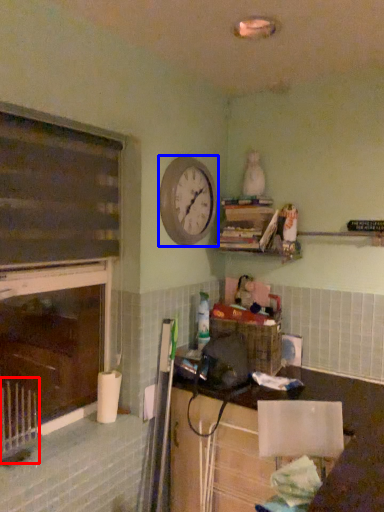
Question: Among these objects, which one is nearest to the camera, radiator (highlighted by a red box) or clock (highlighted by a blue box)?

Choices:
 (A) radiator
 (B) clock

Answer: (A)